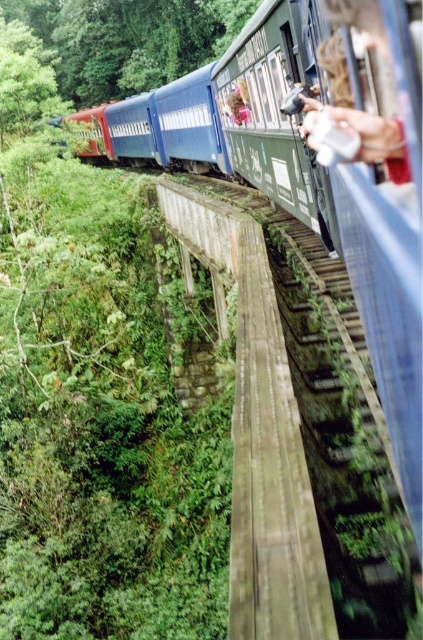
Who is positioned more to the right, green stone bridge at center or light brown hair at upper center?

From the viewer's perspective, light brown hair at upper center appears more on the right side.

The height and width of the screenshot is (640, 423). What do you see at coordinates (258, 433) in the screenshot? I see `green stone bridge at center` at bounding box center [258, 433].

Find the location of a particular element. green stone bridge at center is located at coordinates (x=258, y=433).

Can you confirm if green leafy tree at upper left is positioned to the left of light brown hair at upper center?

Correct, you'll find green leafy tree at upper left to the left of light brown hair at upper center.

Does point (129, 17) come in front of point (231, 100)?

No, (129, 17) is further to viewer.

At what (x,y) coordinates should I click in order to perform the action: click on green leafy tree at upper left. Please return your answer as a coordinate pair (x, y). The height and width of the screenshot is (640, 423). Looking at the image, I should click on (129, 38).

This screenshot has width=423, height=640. Find the location of `green leafy tree at upper left`. green leafy tree at upper left is located at coordinates (129, 38).

Between blue painted metal train car at center and light brown hair at upper center, which one has more height?

blue painted metal train car at center is taller.

In the scene shown: Is blue painted metal train car at center wider than light brown hair at upper center?

Yes, blue painted metal train car at center is wider than light brown hair at upper center.

Which is behind, point (307, 6) or point (241, 120)?

The point (241, 120) is behind.

Identify the location of blue painted metal train car at center. (277, 108).